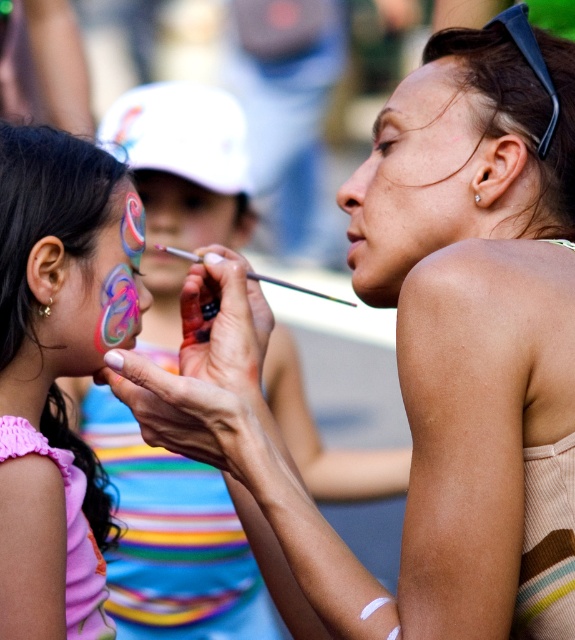
You are an artist observing the scene and need to reach for the shiny pink face paint at left and the matte paintbrush at center. Which object is closer to your right hand if you are facing the image?

The matte paintbrush at center is closer to your right hand because the shiny pink face paint at left is to the left of matte paintbrush at center, meaning the paintbrush is positioned to the right of the face paint.

You are an artist observing the scene. You need to reach for the shiny metallic face paint at left and the matte paintbrush at center. Which object is closer to your right hand if your right hand is near the center?

The matte paintbrush at center is closer to your right hand because it is positioned at the center, which is closer to the right side than the shiny metallic face paint at left.